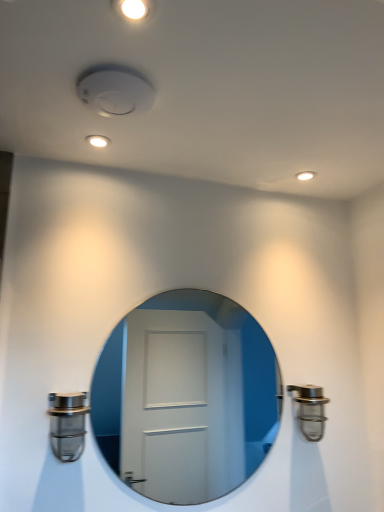
Question: Does satin nickel door handle at lower left, which is counted as the second door handle, starting from the right, lie behind satin nickel faucet at right, the second door handle positioned from the left?

Choices:
 (A) no
 (B) yes

Answer: (A)

Question: Are satin nickel door handle at lower left, arranged as the 2th door handle when viewed from the back, and satin nickel faucet at right, the first door handle from the right, far apart?

Choices:
 (A) yes
 (B) no

Answer: (B)

Question: Considering the relative sizes of satin nickel door handle at lower left, the 1th door handle from the front, and satin nickel faucet at right, the second door handle in the front-to-back sequence, in the image provided, is satin nickel door handle at lower left, the 1th door handle from the front, taller than satin nickel faucet at right, the second door handle in the front-to-back sequence,?

Choices:
 (A) yes
 (B) no

Answer: (B)

Question: Can you confirm if satin nickel door handle at lower left, the 1th door handle in the left-to-right sequence, is thinner than satin nickel faucet at right, the second door handle in the front-to-back sequence?

Choices:
 (A) yes
 (B) no

Answer: (B)

Question: Can you confirm if satin nickel door handle at lower left, the 1th door handle from the front, is wider than satin nickel faucet at right, the first door handle from the right?

Choices:
 (A) no
 (B) yes

Answer: (B)

Question: Considering the relative sizes of satin nickel door handle at lower left, which is counted as the second door handle, starting from the right, and satin nickel faucet at right, the first door handle from the right, in the image provided, is satin nickel door handle at lower left, which is counted as the second door handle, starting from the right, shorter than satin nickel faucet at right, the first door handle from the right,?

Choices:
 (A) yes
 (B) no

Answer: (A)

Question: Is white glossy mirror at center at the right side of satin nickel faucet at right, the 1th door handle viewed from the back?

Choices:
 (A) no
 (B) yes

Answer: (A)

Question: Is white glossy mirror at center positioned in front of satin nickel faucet at right, the second door handle positioned from the left?

Choices:
 (A) yes
 (B) no

Answer: (A)

Question: Is white glossy mirror at center with satin nickel faucet at right, the second door handle in the front-to-back sequence?

Choices:
 (A) yes
 (B) no

Answer: (B)

Question: From a real-world perspective, does white glossy mirror at center stand above satin nickel faucet at right, the first door handle from the right?

Choices:
 (A) yes
 (B) no

Answer: (A)

Question: From a real-world perspective, is white glossy mirror at center positioned under satin nickel faucet at right, the second door handle in the front-to-back sequence, based on gravity?

Choices:
 (A) no
 (B) yes

Answer: (A)

Question: Can you confirm if white glossy mirror at center is bigger than satin nickel faucet at right, the second door handle in the front-to-back sequence?

Choices:
 (A) yes
 (B) no

Answer: (A)

Question: From the image's perspective, is satin nickel door handle at lower left, the 1th door handle in the left-to-right sequence, below white glossy mirror at center?

Choices:
 (A) no
 (B) yes

Answer: (B)